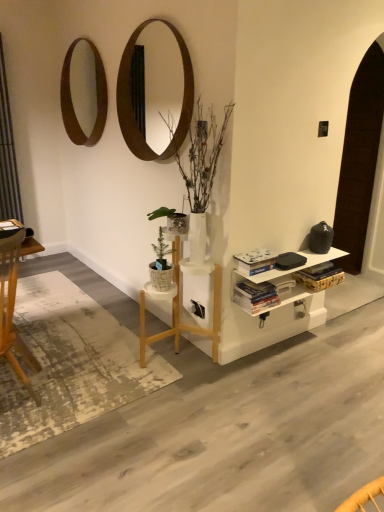
Question: Is green leafy plant at center in front of hardcover book at center, acting as the 1th book starting from the top?

Choices:
 (A) no
 (B) yes

Answer: (B)

Question: Considering the relative positions of green leafy plant at center and hardcover book at center, the second book positioned from the bottom, in the image provided, is green leafy plant at center behind hardcover book at center, the second book positioned from the bottom,?

Choices:
 (A) no
 (B) yes

Answer: (A)

Question: Is green leafy plant at center smaller than hardcover book at center, the second book positioned from the bottom?

Choices:
 (A) yes
 (B) no

Answer: (B)

Question: From a real-world perspective, does green leafy plant at center stand above hardcover book at center, the second book positioned from the bottom?

Choices:
 (A) yes
 (B) no

Answer: (A)

Question: Is green leafy plant at center beside hardcover book at center, the second book positioned from the bottom?

Choices:
 (A) yes
 (B) no

Answer: (B)

Question: Looking at their shapes, would you say hardcover books at center, the second book positioned from the top, is wider or thinner than wooden mirror at upper center, which ranks as the 2th mirror in left-to-right order?

Choices:
 (A) thin
 (B) wide

Answer: (B)

Question: Does point (248, 281) appear closer or farther from the camera than point (158, 90)?

Choices:
 (A) farther
 (B) closer

Answer: (B)

Question: From the image's perspective, is hardcover books at center, the second book positioned from the top, located above or below wooden mirror at upper center, acting as the first mirror starting from the right?

Choices:
 (A) above
 (B) below

Answer: (B)

Question: From a real-world perspective, is hardcover books at center, the second book positioned from the top, physically located above or below wooden mirror at upper center, which ranks as the 2th mirror in left-to-right order?

Choices:
 (A) above
 (B) below

Answer: (B)

Question: Based on their positions, is green leafy plant at center located to the left or right of white painted wood shelf at lower right?

Choices:
 (A) left
 (B) right

Answer: (A)

Question: From the image's perspective, is green leafy plant at center located above or below white painted wood shelf at lower right?

Choices:
 (A) below
 (B) above

Answer: (B)

Question: In terms of width, does green leafy plant at center look wider or thinner when compared to white painted wood shelf at lower right?

Choices:
 (A) wide
 (B) thin

Answer: (B)

Question: Is green leafy plant at center in front of or behind white painted wood shelf at lower right in the image?

Choices:
 (A) front
 (B) behind

Answer: (A)

Question: Considering the positions of white wood table at center and hardcover books at center, placed as the first book when sorted from bottom to top, in the image, is white wood table at center wider or thinner than hardcover books at center, placed as the first book when sorted from bottom to top,?

Choices:
 (A) thin
 (B) wide

Answer: (B)

Question: Considering the relative positions of white wood table at center and hardcover books at center, the second book positioned from the top, in the image provided, is white wood table at center to the left or to the right of hardcover books at center, the second book positioned from the top,?

Choices:
 (A) left
 (B) right

Answer: (A)